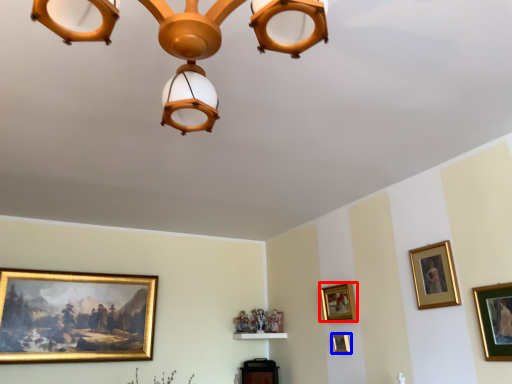
Question: Which object is further to the camera taking this photo, picture frame (highlighted by a red box) or picture frame (highlighted by a blue box)?

Choices:
 (A) picture frame
 (B) picture frame

Answer: (B)